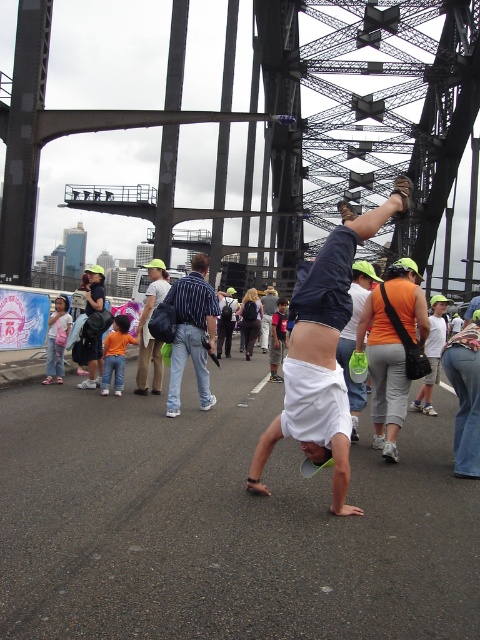
Question: Observing the image, what is the correct spatial positioning of black steel bridge at center in reference to striped shirt at center?

Choices:
 (A) right
 (B) left

Answer: (B)

Question: Does black steel bridge at center appear on the left side of striped shirt at center?

Choices:
 (A) yes
 (B) no

Answer: (A)

Question: Is black steel bridge at center thinner than striped shirt at center?

Choices:
 (A) no
 (B) yes

Answer: (A)

Question: Which object appears closest to the camera in this image?

Choices:
 (A) striped shirt at center
 (B) black steel bridge at center

Answer: (A)